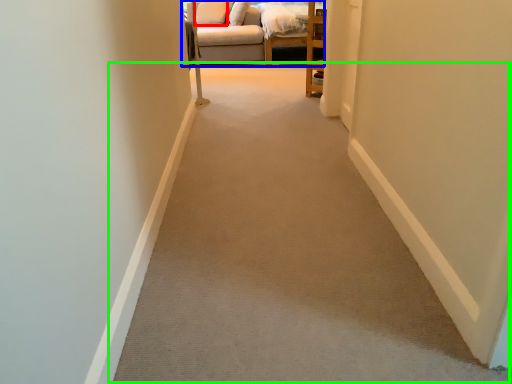
Question: Which object is the closest to the pillow (highlighted by a red box)? Choose among these: studio couch (highlighted by a blue box) or path (highlighted by a green box).

Choices:
 (A) studio couch
 (B) path

Answer: (A)